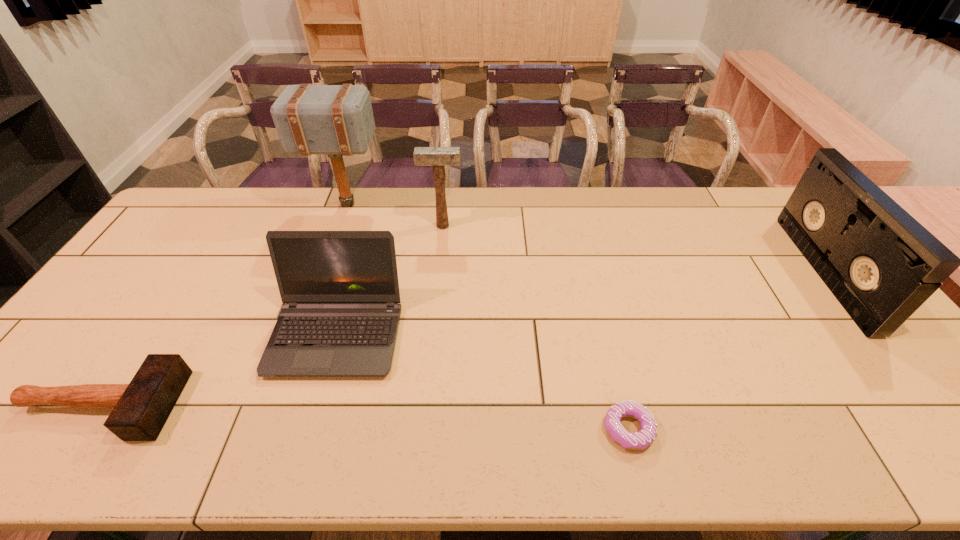
Image resolution: width=960 pixels, height=540 pixels. In the image, there is a desktop. What are the coordinates of `vacant area at the near edge` in the screenshot? It's located at (718, 462).

The width and height of the screenshot is (960, 540). In the image, there is a desktop. In order to click on free space at the left edge in this screenshot , I will do `click(118, 285)`.

Locate an element on the screen. Image resolution: width=960 pixels, height=540 pixels. free spot at the right edge of the desktop is located at coordinates (831, 297).

Find the location of a particular element. unoccupied area between the laptop_computer and the rightmost object is located at coordinates (581, 303).

Locate an element on the screen. Image resolution: width=960 pixels, height=540 pixels. blank region between the fifth object from left to right and the tallest mallet is located at coordinates (488, 316).

Identify the location of free space between the second shortest mallet and the videotape. This screenshot has height=540, width=960. (634, 249).

Find the location of a particular element. The image size is (960, 540). free space between the laptop_computer and the videotape is located at coordinates 581,303.

You are a GUI agent. You are given a task and a screenshot of the screen. Output one action in this format:
    pyautogui.click(x=<x>, y=<y>)
    Task: Click on the free space between the second farthest mallet and the rightmost object
    The height and width of the screenshot is (540, 960).
    Given the screenshot: What is the action you would take?
    pyautogui.click(x=634, y=249)

Select which object is the fifth closest to the tallest object. Please provide its 2D coordinates. Your answer should be formatted as a tuple, i.e. [(x, y)], where the tuple contains the x and y coordinates of a point satisfying the conditions above.

[(881, 264)]

Identify which object is the fourth nearest to the nearest mallet. Please provide its 2D coordinates. Your answer should be formatted as a tuple, i.e. [(x, y)], where the tuple contains the x and y coordinates of a point satisfying the conditions above.

[(643, 438)]